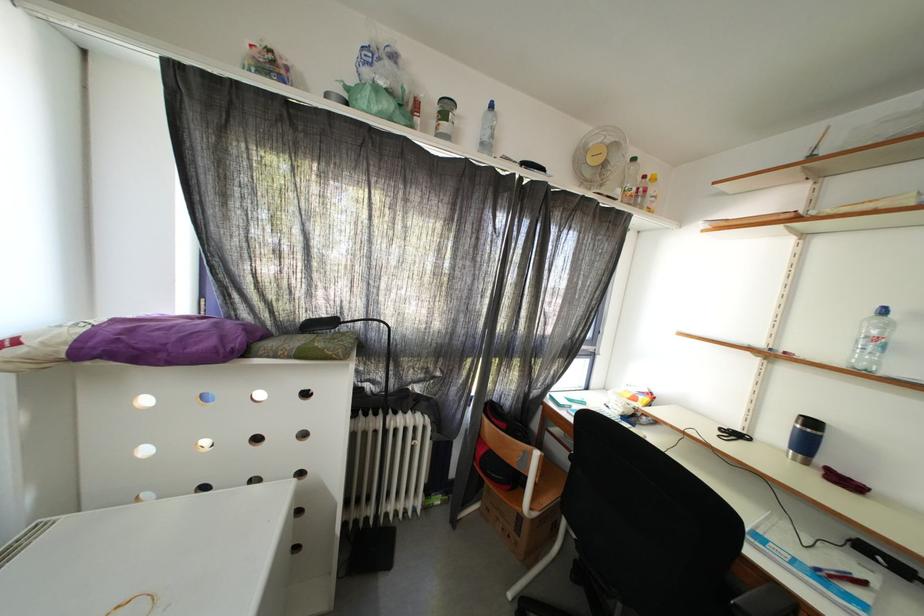
Describe the element at coordinates (815, 564) in the screenshot. Image resolution: width=924 pixels, height=616 pixels. I see `the blue spiral notebook` at that location.